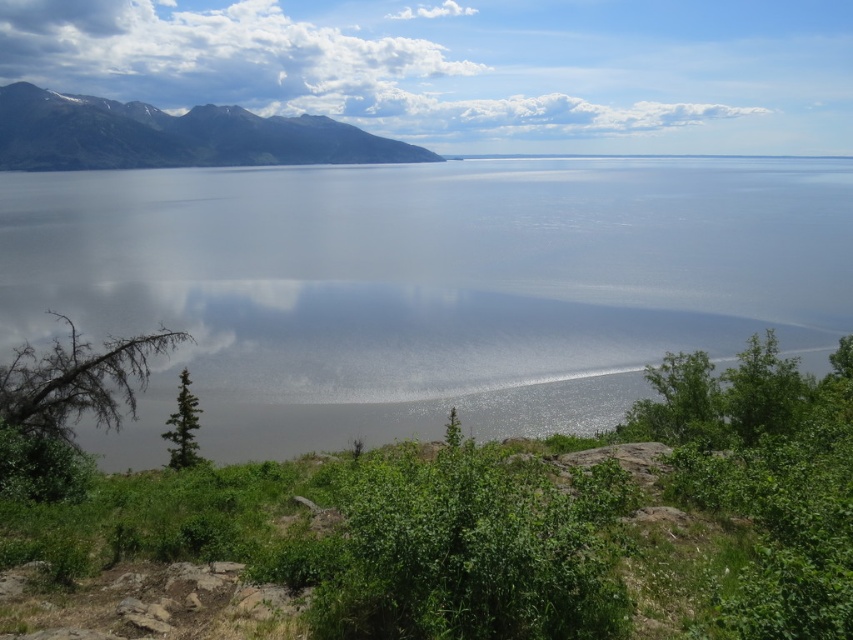
Who is more forward, (82, 72) or (222, 108)?

Point (222, 108) is in front.

Who is positioned more to the right, white fluffy cloud at upper left or rocky brown mountain at upper left?

From the viewer's perspective, rocky brown mountain at upper left appears more on the right side.

Is point (341, 112) farther from viewer compared to point (112, 122)?

Yes, point (341, 112) is behind point (112, 122).

I want to click on white fluffy cloud at upper left, so click(213, 58).

How distant is white fluffy cloud at upper center from white fluffy cloud at upper left?

white fluffy cloud at upper center is 47.65 meters from white fluffy cloud at upper left.

Can you confirm if white fluffy cloud at upper center is shorter than white fluffy cloud at upper left?

Incorrect, white fluffy cloud at upper center's height does not fall short of white fluffy cloud at upper left's.

Which is in front, point (759, 125) or point (160, 52)?

Positioned in front is point (759, 125).

The height and width of the screenshot is (640, 853). In order to click on white fluffy cloud at upper center in this screenshot , I will do click(468, 67).

Is glistening water at center wider than white fluffy cloud at upper left?

No.

Does point (369, 237) lie in front of point (10, 35)?

Yes, it is in front of point (10, 35).

What do you see at coordinates (424, 288) in the screenshot? I see `glistening water at center` at bounding box center [424, 288].

At what (x,y) coordinates should I click in order to perform the action: click on glistening water at center. Please return your answer as a coordinate pair (x, y). The image size is (853, 640). Looking at the image, I should click on (424, 288).